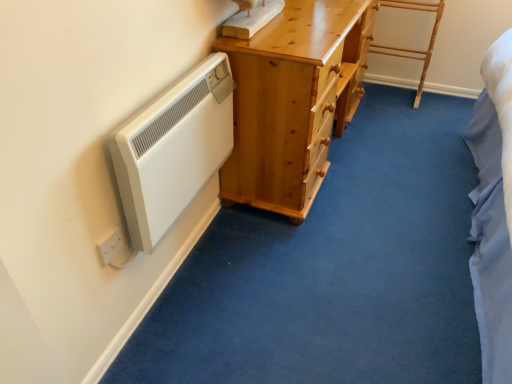
The width and height of the screenshot is (512, 384). I want to click on free space in front of light brown wooden chest of drawers at center, so click(x=337, y=255).